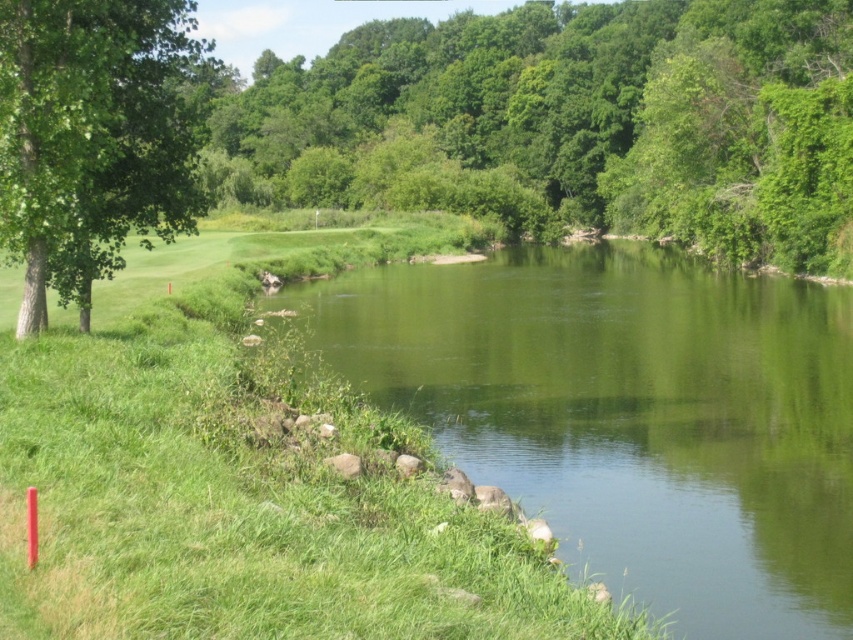
Based on the photo, does green grassy golf course at lower left have a larger size compared to green leafy tree at left?

Actually, green grassy golf course at lower left might be smaller than green leafy tree at left.

Between green grassy golf course at lower left and green leafy tree at left, which one is positioned lower?

Positioned lower is green grassy golf course at lower left.

This screenshot has width=853, height=640. Find the location of `green grassy golf course at lower left`. green grassy golf course at lower left is located at coordinates (244, 483).

Is green grassy golf course at lower left positioned at the back of green leafy tree at upper center?

No, green grassy golf course at lower left is in front of green leafy tree at upper center.

Is green grassy golf course at lower left bigger than green leafy tree at upper center?

Incorrect, green grassy golf course at lower left is not larger than green leafy tree at upper center.

What do you see at coordinates (244, 483) in the screenshot? The image size is (853, 640). I see `green grassy golf course at lower left` at bounding box center [244, 483].

This screenshot has width=853, height=640. Identify the location of green grassy golf course at lower left. (244, 483).

Which is behind, point (602, 433) or point (80, 179)?

Point (602, 433)

Which is more to the left, green smooth water at center or green leafy tree at left?

From the viewer's perspective, green leafy tree at left appears more on the left side.

Who is more distant from viewer, [833,410] or [15,99]?

The point [833,410] is more distant.

At what (x,y) coordinates should I click in order to perform the action: click on green smooth water at center. Please return your answer as a coordinate pair (x, y). Looking at the image, I should click on (630, 416).